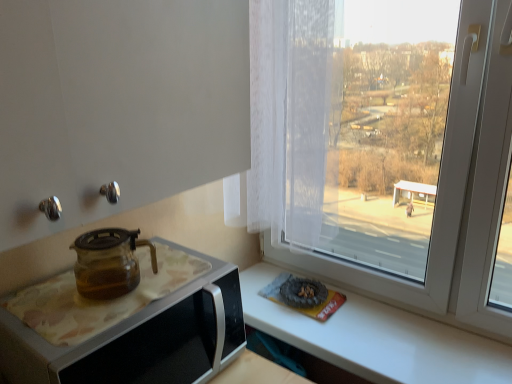
The width and height of the screenshot is (512, 384). In order to click on vacant space that is to the left of transparent glass teapot at left in this screenshot , I will do `click(50, 304)`.